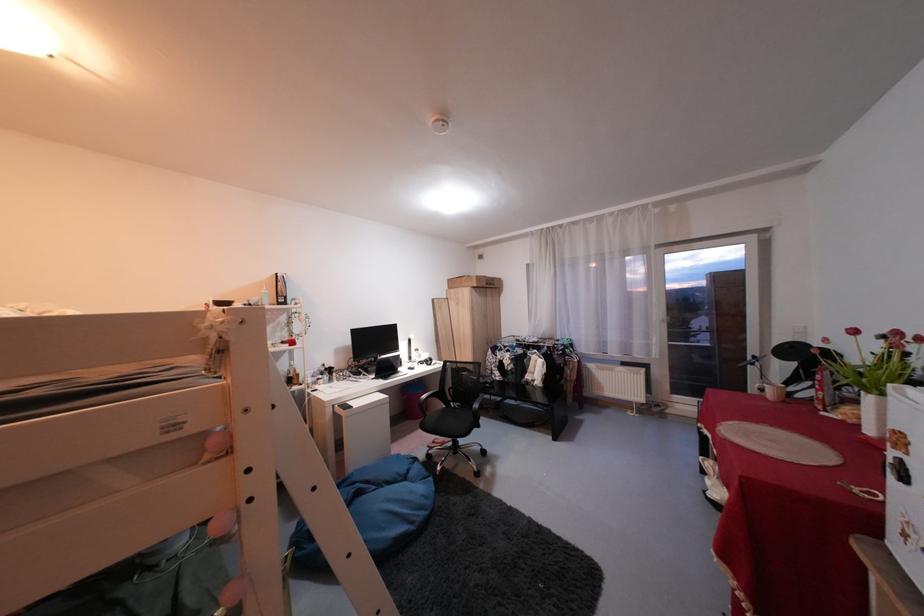
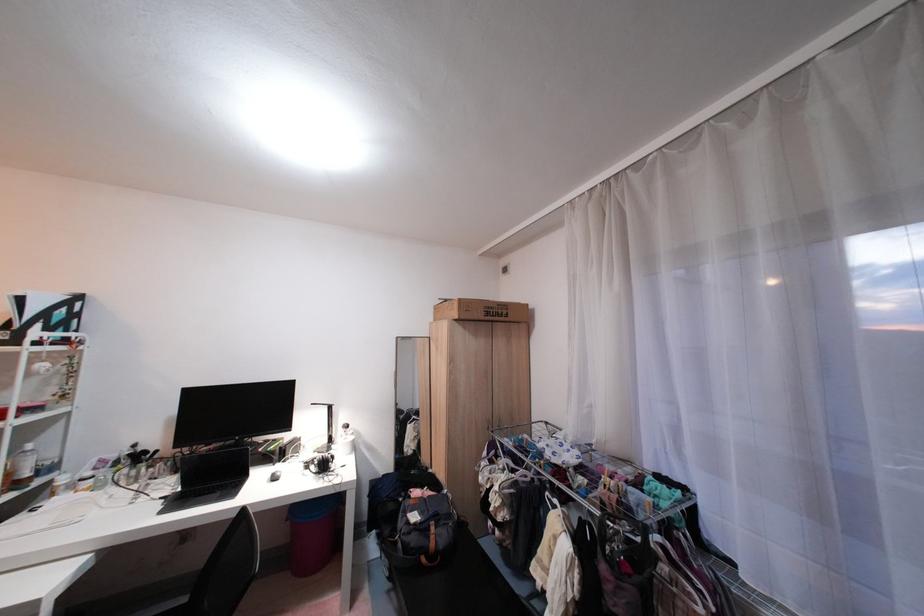
Where in the second image is the point corresponding to the point at 383,381 from the first image?

(172, 500)